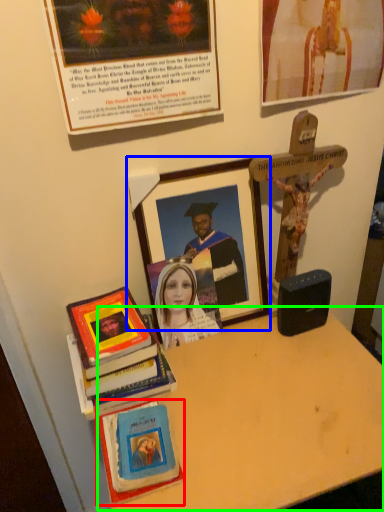
Question: Considering the real-world distances, which object is farthest from book (highlighted by a red box)? picture frame (highlighted by a blue box) or table (highlighted by a green box)?

Choices:
 (A) picture frame
 (B) table

Answer: (A)